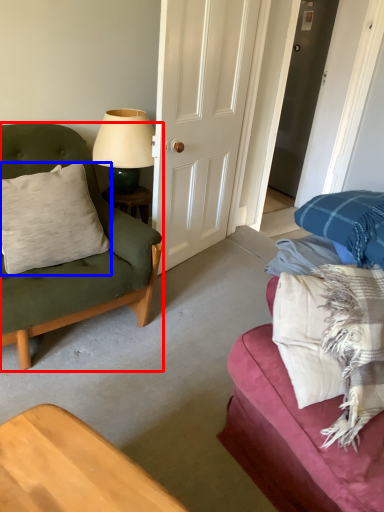
Question: Among these objects, which one is nearest to the camera, chair (highlighted by a red box) or pillow (highlighted by a blue box)?

Choices:
 (A) chair
 (B) pillow

Answer: (A)